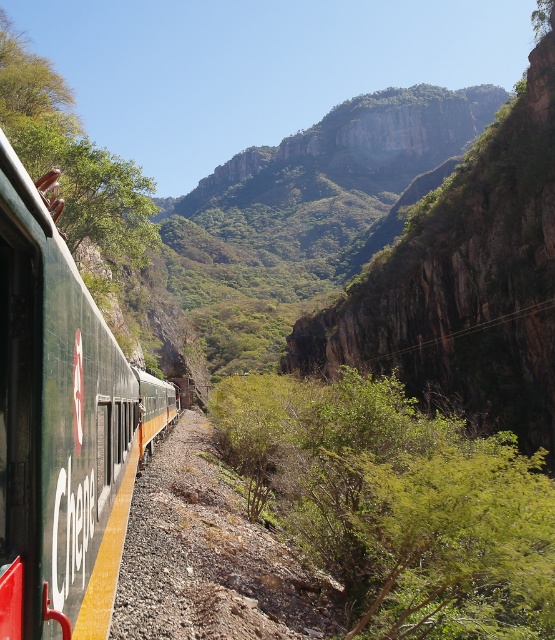
Between green rocky cliff at upper center and green matte train at left, which one has less height?

green matte train at left is shorter.

Between point (503, 337) and point (26, 618), which one is positioned behind?

Point (503, 337)

Between point (487, 172) and point (13, 196), which one is positioned in front?

Point (13, 196) is in front.

Locate an element on the screen. The width and height of the screenshot is (555, 640). green rocky cliff at upper center is located at coordinates (466, 280).